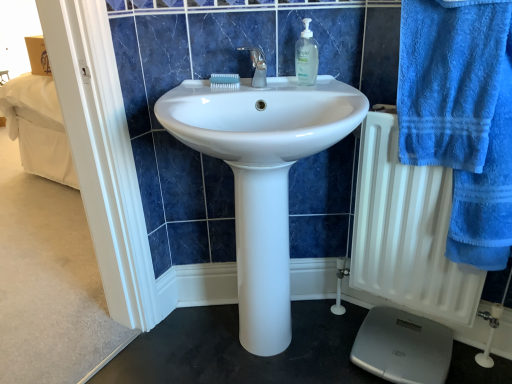
The image size is (512, 384). In order to click on vacant region above gray plastic scale at lower right (from a real-world perspective) in this screenshot , I will do `click(407, 347)`.